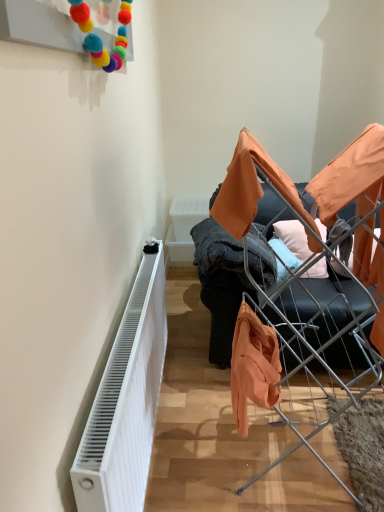
Question: Does soft cotton pillow at center come in front of orange fabric at center?

Choices:
 (A) no
 (B) yes

Answer: (A)

Question: Considering the relative sizes of soft cotton pillow at center and orange fabric at center in the image provided, is soft cotton pillow at center thinner than orange fabric at center?

Choices:
 (A) yes
 (B) no

Answer: (A)

Question: Does soft cotton pillow at center appear on the left side of orange fabric at center?

Choices:
 (A) yes
 (B) no

Answer: (B)

Question: From the image's perspective, is soft cotton pillow at center under orange fabric at center?

Choices:
 (A) yes
 (B) no

Answer: (B)

Question: Does soft cotton pillow at center turn towards orange fabric at center?

Choices:
 (A) no
 (B) yes

Answer: (B)

Question: From a real-world perspective, is soft cotton pillow at center on top of orange fabric at center?

Choices:
 (A) yes
 (B) no

Answer: (B)

Question: Is soft cotton pillow at center positioned in front of orange fabric couch at center?

Choices:
 (A) no
 (B) yes

Answer: (A)

Question: Does soft cotton pillow at center appear on the right side of orange fabric couch at center?

Choices:
 (A) yes
 (B) no

Answer: (B)

Question: Can you confirm if soft cotton pillow at center is thinner than orange fabric couch at center?

Choices:
 (A) no
 (B) yes

Answer: (B)

Question: Does soft cotton pillow at center have a lesser height compared to orange fabric couch at center?

Choices:
 (A) no
 (B) yes

Answer: (B)

Question: Is orange fabric couch at center surrounded by soft cotton pillow at center?

Choices:
 (A) yes
 (B) no

Answer: (B)

Question: Is soft cotton pillow at center touching orange fabric couch at center?

Choices:
 (A) no
 (B) yes

Answer: (A)

Question: Is orange fabric at center surrounded by orange fabric couch at center?

Choices:
 (A) no
 (B) yes

Answer: (A)